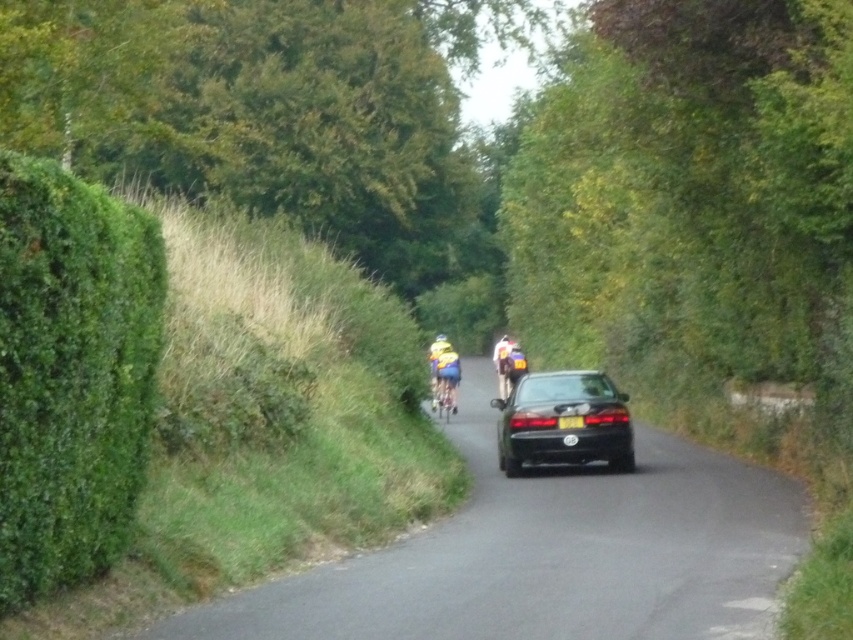
You are standing at the point marked by the coordinates (444, 397) in the rural road scene. What object is located exactly at this point?

The yellow fabric bicycle at center is located exactly at the coordinates (444, 397).